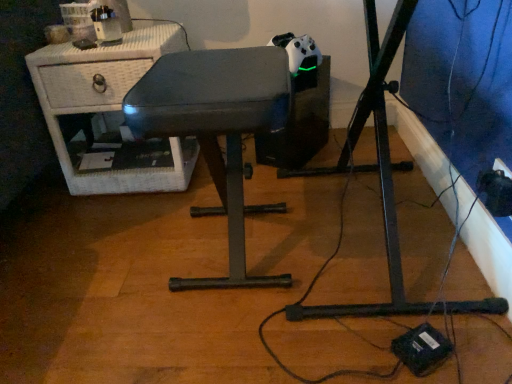
Where is `free location to the left of metallic gray stool at center, which appears as the first furniture when viewed from the right`? This screenshot has width=512, height=384. free location to the left of metallic gray stool at center, which appears as the first furniture when viewed from the right is located at coordinates (96, 264).